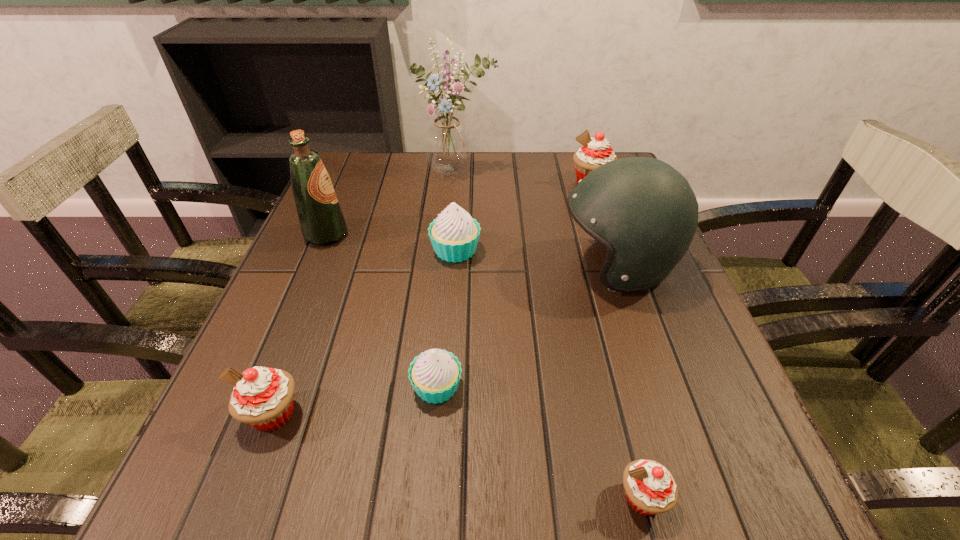
Identify the location of object present at the near right corner. Image resolution: width=960 pixels, height=540 pixels. (650, 488).

The image size is (960, 540). In the image, there is a desktop. What are the coordinates of `vacant space at the far edge` in the screenshot? It's located at (569, 181).

In the image, there is a desktop. Where is `vacant space at the near edge`? Image resolution: width=960 pixels, height=540 pixels. vacant space at the near edge is located at coordinates (411, 476).

You are a GUI agent. You are given a task and a screenshot of the screen. Output one action in this format:
    pyautogui.click(x=<x>, y=<y>)
    Task: Click on the vacant region at the left edge of the desktop
    The width and height of the screenshot is (960, 540).
    Given the screenshot: What is the action you would take?
    pyautogui.click(x=253, y=343)

Locate an element on the screen. This screenshot has width=960, height=540. free region at the right edge is located at coordinates (664, 287).

At what (x,y) coordinates should I click in order to perform the action: click on free space at the near left corner. Please return your answer as a coordinate pair (x, y). This screenshot has height=540, width=960. Looking at the image, I should click on (271, 495).

In the image, there is a desktop. Where is `free space at the near right corner`? free space at the near right corner is located at coordinates (732, 461).

You are a GUI agent. You are given a task and a screenshot of the screen. Output one action in this format:
    pyautogui.click(x=<x>, y=<y>)
    Task: Click on the unoccupied position between the tallest object and the biggest pink cupcake
    Image resolution: width=960 pixels, height=540 pixels.
    Given the screenshot: What is the action you would take?
    pyautogui.click(x=523, y=177)

Find the location of a particular element. The image size is (960, 540). vacant area that lies between the olive oil and the leftmost pink cupcake is located at coordinates (300, 324).

The height and width of the screenshot is (540, 960). I want to click on free spot between the fourth nearest cupcake and the nearer white cupcake, so click(446, 319).